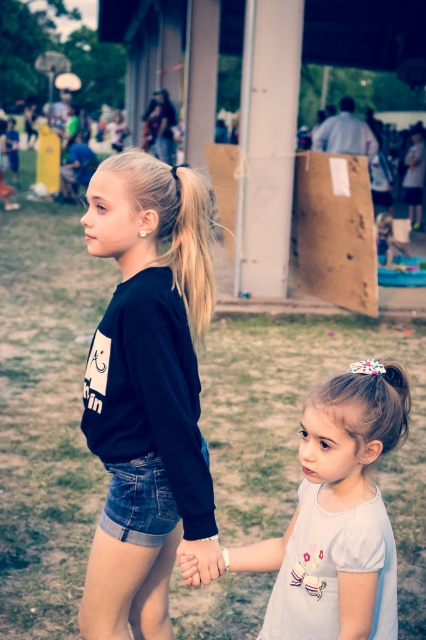
You are standing in the park and see the black matte sweatshirt at center and the white matte dress at lower right. Which one is closer to you?

The black matte sweatshirt at center is closer to you because it is further to the viewer than the white matte dress at lower right.

You are a photographer trying to capture a candid shot of the two girls holding hands. You notice the black matte sweatshirt at center and the smooth skin hand at center. Which object is located to the left of the other?

The black matte sweatshirt at center is positioned on the left side of smooth skin hand at center.

You are a photographer setting up for a group photo. You have two black outfits in the scene, a black matte sweatshirt at center and a matte black dress at upper center. Which one is narrower?

The black matte sweatshirt at center is narrower than the matte black dress at upper center.